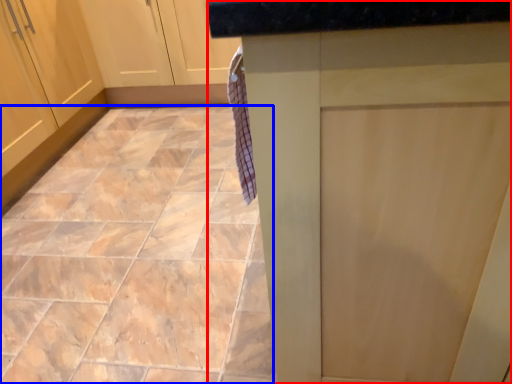
Question: Which of the following is the farthest to the observer, counter (highlighted by a red box) or ceramic tile (highlighted by a blue box)?

Choices:
 (A) counter
 (B) ceramic tile

Answer: (B)